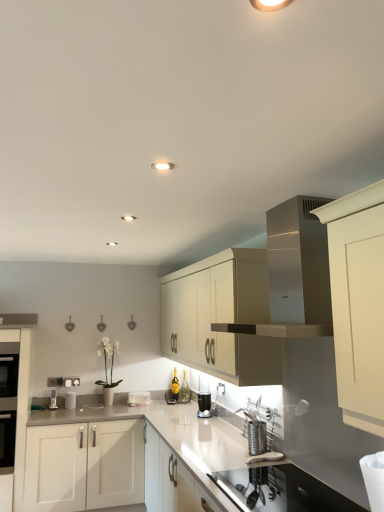
Question: Considering the relative sizes of matte cream cabinet at center, the second cabinetry from the left, and white glossy countertop at center in the image provided, is matte cream cabinet at center, the second cabinetry from the left, smaller than white glossy countertop at center?

Choices:
 (A) no
 (B) yes

Answer: (B)

Question: Is matte cream cabinet at center, the first cabinetry from the right, positioned with its back to white glossy countertop at center?

Choices:
 (A) yes
 (B) no

Answer: (B)

Question: Does matte cream cabinet at center, the first cabinetry from the right, come in front of white glossy countertop at center?

Choices:
 (A) yes
 (B) no

Answer: (B)

Question: From the image's perspective, is matte cream cabinet at center, the second cabinetry from the left, over white glossy countertop at center?

Choices:
 (A) yes
 (B) no

Answer: (A)

Question: Is white glossy countertop at center located within matte cream cabinet at center, the first cabinetry from the right?

Choices:
 (A) no
 (B) yes

Answer: (A)

Question: In the image, is white glossy cabinet at left, arranged as the 2th cabinetry when viewed from the right, on the left side or the right side of black glass oven at left?

Choices:
 (A) right
 (B) left

Answer: (A)

Question: Looking at their shapes, would you say white glossy cabinet at left, arranged as the 1th cabinetry when viewed from the left, is wider or thinner than black glass oven at left?

Choices:
 (A) thin
 (B) wide

Answer: (A)

Question: Relative to black glass oven at left, is white glossy cabinet at left, arranged as the 1th cabinetry when viewed from the left, in front or behind?

Choices:
 (A) behind
 (B) front

Answer: (B)

Question: In terms of height, does white glossy cabinet at left, arranged as the 1th cabinetry when viewed from the left, look taller or shorter compared to black glass oven at left?

Choices:
 (A) tall
 (B) short

Answer: (A)

Question: Based on their positions, is white glossy toaster at lower left, acting as the second appliance starting from the back, located to the left or right of clear glass cup at center, acting as the 3th appliance starting from the left?

Choices:
 (A) right
 (B) left

Answer: (B)

Question: Is white glossy toaster at lower left, acting as the second appliance starting from the back, in front of or behind clear glass cup at center, acting as the 3th appliance starting from the left, in the image?

Choices:
 (A) behind
 (B) front

Answer: (A)

Question: From a real-world perspective, is white glossy toaster at lower left, positioned as the 2th appliance in front-to-back order, above or below clear glass cup at center, which is the first appliance in front-to-back order?

Choices:
 (A) above
 (B) below

Answer: (B)

Question: From the image's perspective, is white glossy toaster at lower left, the 1th appliance positioned from the left, above or below clear glass cup at center, the 3th appliance in the back-to-front sequence?

Choices:
 (A) below
 (B) above

Answer: (A)

Question: Considering their positions, is clear glass cup at center, the 3th appliance in the back-to-front sequence, located in front of or behind white glossy toaster at center, which is the 2th appliance in left-to-right order?

Choices:
 (A) front
 (B) behind

Answer: (A)

Question: Would you say clear glass cup at center, acting as the 3th appliance starting from the left, is inside or outside white glossy toaster at center, the second appliance in the right-to-left sequence?

Choices:
 (A) inside
 (B) outside

Answer: (B)